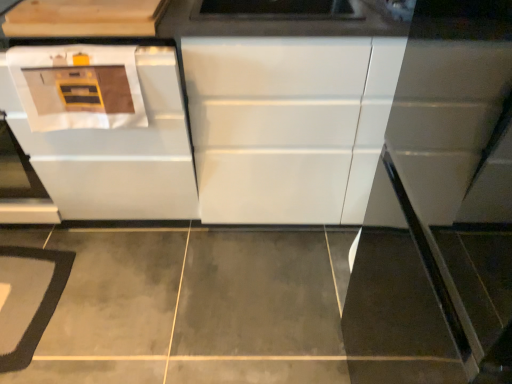
Question: From the image's perspective, is white glossy oven at left under light wood cabinet at upper left, arranged as the 2th cabinetry when viewed from the right?

Choices:
 (A) no
 (B) yes

Answer: (B)

Question: Is white glossy oven at left beside light wood cabinet at upper left, the first cabinetry from the left?

Choices:
 (A) no
 (B) yes

Answer: (A)

Question: Is white glossy oven at left to the right of light wood cabinet at upper left, the first cabinetry from the left, from the viewer's perspective?

Choices:
 (A) no
 (B) yes

Answer: (B)

Question: Is white glossy oven at left not within light wood cabinet at upper left, arranged as the 2th cabinetry when viewed from the right?

Choices:
 (A) no
 (B) yes

Answer: (B)

Question: From a real-world perspective, is white glossy oven at left positioned over light wood cabinet at upper left, the first cabinetry from the left, based on gravity?

Choices:
 (A) no
 (B) yes

Answer: (A)

Question: From the image's perspective, relative to gray carpet at lower left, is white glossy oven at left above or below?

Choices:
 (A) above
 (B) below

Answer: (A)

Question: From a real-world perspective, relative to gray carpet at lower left, is white glossy oven at left vertically above or below?

Choices:
 (A) above
 (B) below

Answer: (A)

Question: Is white glossy oven at left to the left or to the right of gray carpet at lower left in the image?

Choices:
 (A) right
 (B) left

Answer: (A)

Question: In the image, is white glossy oven at left positioned in front of or behind gray carpet at lower left?

Choices:
 (A) behind
 (B) front

Answer: (B)

Question: Is light wood cabinet at upper left, the first cabinetry from the left, wider or thinner than white glossy cabinet at center, the first cabinetry positioned from the right?

Choices:
 (A) wide
 (B) thin

Answer: (B)

Question: From a real-world perspective, is light wood cabinet at upper left, arranged as the 2th cabinetry when viewed from the right, positioned above or below white glossy cabinet at center, which is counted as the 2th cabinetry, starting from the left?

Choices:
 (A) above
 (B) below

Answer: (A)

Question: In the image, is light wood cabinet at upper left, arranged as the 2th cabinetry when viewed from the right, positioned in front of or behind white glossy cabinet at center, the first cabinetry positioned from the right?

Choices:
 (A) front
 (B) behind

Answer: (A)

Question: Based on their positions, is light wood cabinet at upper left, the first cabinetry from the left, located to the left or right of white glossy cabinet at center, which is counted as the 2th cabinetry, starting from the left?

Choices:
 (A) right
 (B) left

Answer: (B)

Question: In the image, is white glossy oven at left positioned in front of or behind white glossy cabinet at center, which is counted as the 2th cabinetry, starting from the left?

Choices:
 (A) behind
 (B) front

Answer: (B)

Question: Which is correct: white glossy oven at left is inside white glossy cabinet at center, which is counted as the 2th cabinetry, starting from the left, or outside of it?

Choices:
 (A) outside
 (B) inside

Answer: (B)